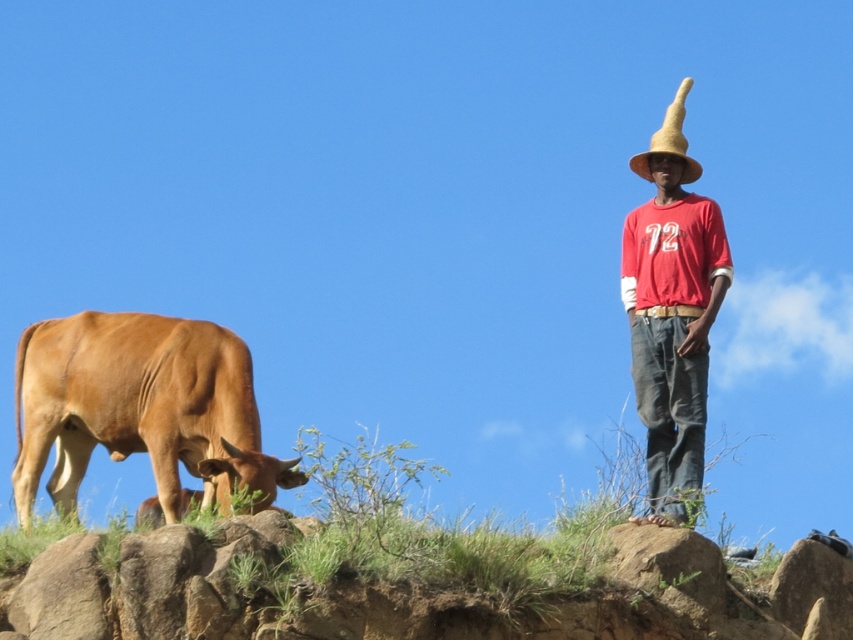
You are a farmer checking the field. You need to place a fence post between the brown smooth bull at left and the straw at right. Which side of the post should be closer to the bull to ensure enough space for both?

The brown smooth bull at left is wider than the straw at right, so the fence post should be placed closer to the straw at right to give the bull enough space.

You are a photographer trying to capture both the brown smooth bull at left and the straw at right in a single frame. Based on their positions, which direction should you move to ensure both are visible in your camera viewfinder?

Since the brown smooth bull at left is to the left of the straw at right, you should move to the left to ensure both the brown smooth bull at left and the straw at right are visible in your camera viewfinder.

You are standing at the point with coordinates point (676, 109) and want to walk to the point with coordinates point (688, 353). Which direction should you move relative to the cow?

You should move towards the direction where point (688, 353) is located, which is in front of point (676, 109). Since the cow is positioned slightly left of center, moving towards point (688, 353) would mean moving to the right relative to the cow.